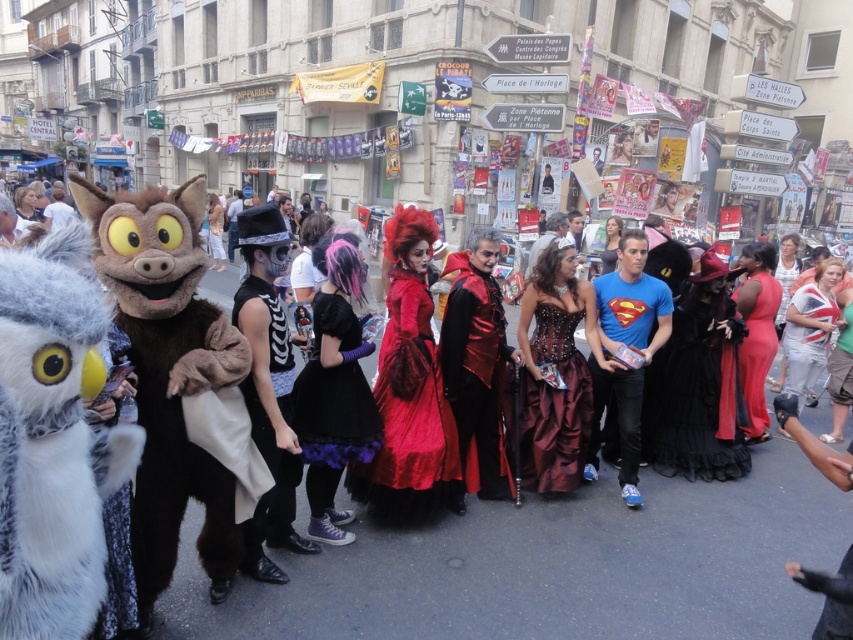
Question: Estimate the real-world distances between objects in this image. Which object is closer to the union jack t-shirt at center?

Choices:
 (A) matte red dress at center
 (B) furry costume at left

Answer: (A)

Question: Can you confirm if black leather vest at center is positioned below burgundy satin corset at center?

Choices:
 (A) no
 (B) yes

Answer: (A)

Question: Among these objects, which one is nearest to the camera?

Choices:
 (A) white furry owl at left
 (B) union jack t-shirt at center
 (C) blue t-shirt at center
 (D) burgundy satin corset at center

Answer: (A)

Question: Can you confirm if brown furry costume at left is smaller than blue t-shirt at center?

Choices:
 (A) no
 (B) yes

Answer: (A)

Question: Does shiny red fabric at center appear on the left side of union jack t-shirt at center?

Choices:
 (A) yes
 (B) no

Answer: (A)

Question: Which point appears closest to the camera in this image?

Choices:
 (A) (68, 460)
 (B) (677, 308)
 (C) (402, 618)

Answer: (A)